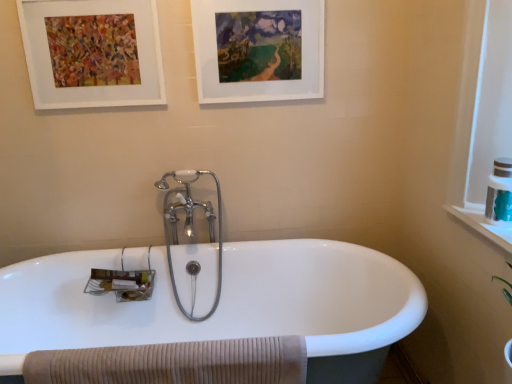
Question: Is white matte picture frame at upper center, the second picture frame viewed from the left, smaller than white matte picture frame at upper left, acting as the 2th picture frame starting from the right?

Choices:
 (A) no
 (B) yes

Answer: (A)

Question: From the image's perspective, is white matte picture frame at upper center, arranged as the 1th picture frame when viewed from the right, over white matte picture frame at upper left, placed as the 1th picture frame when sorted from left to right?

Choices:
 (A) yes
 (B) no

Answer: (A)

Question: Is white matte picture frame at upper center, the second picture frame viewed from the left, bigger than white matte picture frame at upper left, acting as the 2th picture frame starting from the right?

Choices:
 (A) no
 (B) yes

Answer: (B)

Question: Is white matte picture frame at upper center, arranged as the 1th picture frame when viewed from the right, next to white matte picture frame at upper left, acting as the 2th picture frame starting from the right, and touching it?

Choices:
 (A) no
 (B) yes

Answer: (A)

Question: Are white matte picture frame at upper center, the second picture frame viewed from the left, and white matte picture frame at upper left, acting as the 2th picture frame starting from the right, located far from each other?

Choices:
 (A) no
 (B) yes

Answer: (A)

Question: Is white matte picture frame at upper center, the second picture frame viewed from the left, facing towards white matte picture frame at upper left, acting as the 2th picture frame starting from the right?

Choices:
 (A) no
 (B) yes

Answer: (A)

Question: Is polished chrome faucet at center with beige ribbed towel at lower left?

Choices:
 (A) yes
 (B) no

Answer: (B)

Question: Is polished chrome faucet at center far away from beige ribbed towel at lower left?

Choices:
 (A) yes
 (B) no

Answer: (B)

Question: Can you confirm if polished chrome faucet at center is smaller than beige ribbed towel at lower left?

Choices:
 (A) yes
 (B) no

Answer: (B)

Question: Does polished chrome faucet at center have a greater height compared to beige ribbed towel at lower left?

Choices:
 (A) no
 (B) yes

Answer: (B)

Question: Considering the relative sizes of polished chrome faucet at center and beige ribbed towel at lower left in the image provided, is polished chrome faucet at center wider than beige ribbed towel at lower left?

Choices:
 (A) no
 (B) yes

Answer: (B)

Question: From a real-world perspective, is polished chrome faucet at center physically below beige ribbed towel at lower left?

Choices:
 (A) yes
 (B) no

Answer: (B)

Question: Can you confirm if white matte picture frame at upper center, arranged as the 1th picture frame when viewed from the right, is wider than white ceramic bathtub at center?

Choices:
 (A) no
 (B) yes

Answer: (A)